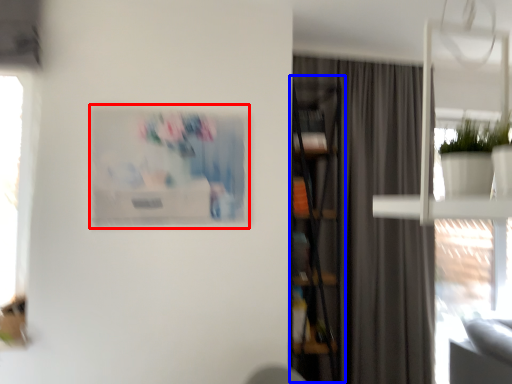
Question: Which object appears farthest to the camera in this image, picture frame (highlighted by a red box) or bookcase (highlighted by a blue box)?

Choices:
 (A) picture frame
 (B) bookcase

Answer: (B)